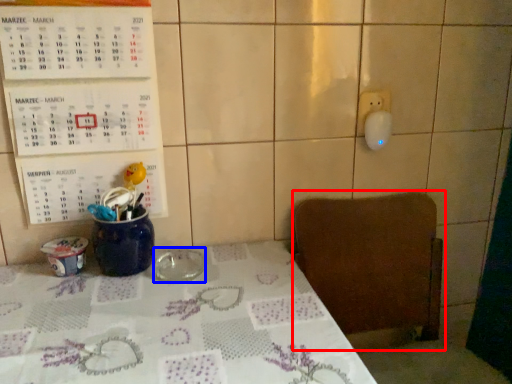
Question: Among these objects, which one is nearest to the camera, chair (highlighted by a red box) or tableware (highlighted by a blue box)?

Choices:
 (A) chair
 (B) tableware

Answer: (A)